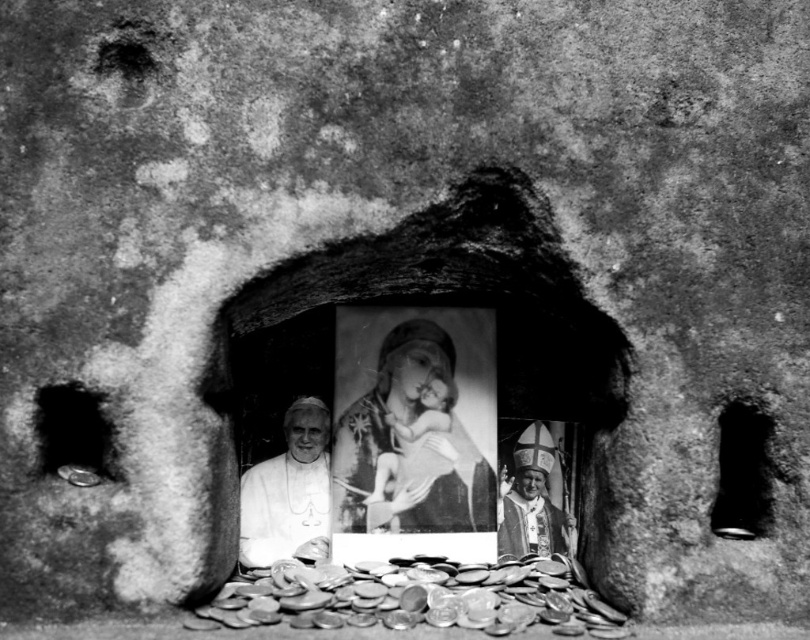
Question: Does shiny metallic coins at lower center appear over metallic coin at left?

Choices:
 (A) no
 (B) yes

Answer: (A)

Question: Can you confirm if shiny metallic coins at lower center is positioned to the right of smooth painted canvas at center?

Choices:
 (A) yes
 (B) no

Answer: (B)

Question: Estimate the real-world distances between objects in this image. Which object is closer to the smooth painted canvas at center?

Choices:
 (A) smooth golden robe at center
 (B) shiny metallic coins at lower center

Answer: (A)

Question: In this image, where is shiny metallic coins at lower center located relative to smooth golden robe at center?

Choices:
 (A) left
 (B) right

Answer: (A)

Question: Among these objects, which one is farthest from the camera?

Choices:
 (A) smooth painted canvas at center
 (B) white matte portrait at center

Answer: (A)

Question: Among these objects, which one is farthest from the camera?

Choices:
 (A) shiny metallic coins at lower center
 (B) white matte portrait at center

Answer: (B)